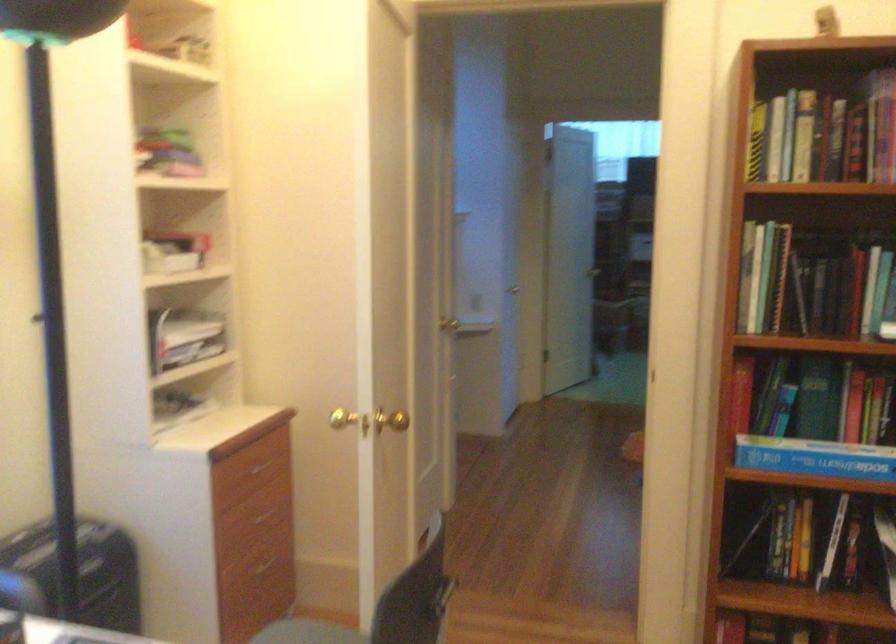
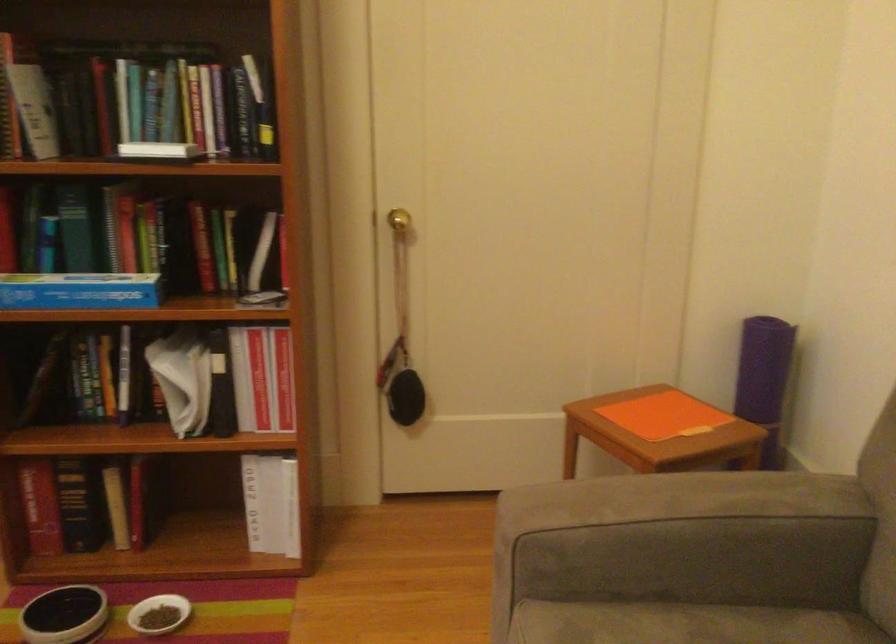
Question: The first image is from the beginning of the video and the second image is from the end. How did the camera likely rotate when shooting the video?

Choices:
 (A) Left
 (B) Right
 (C) Up
 (D) Down

Answer: (B)